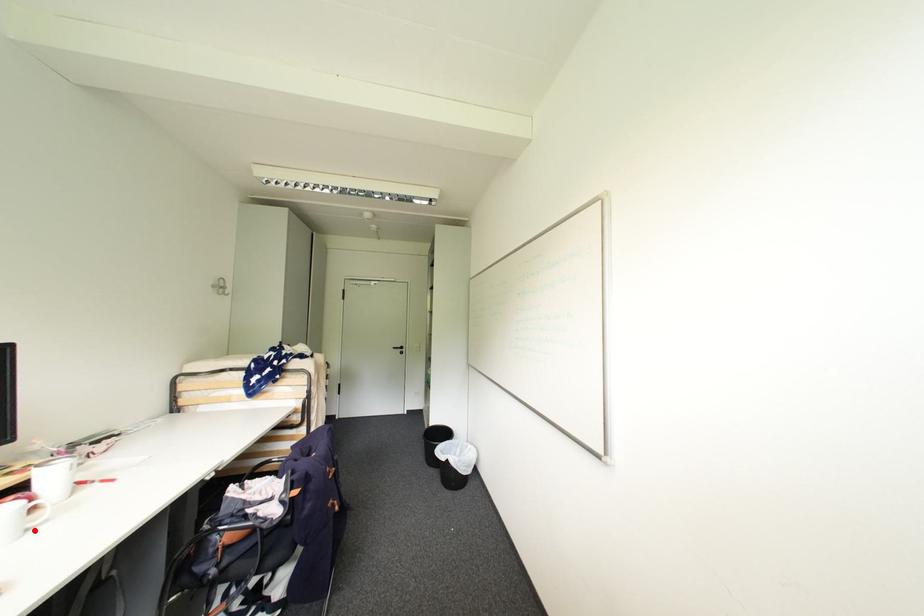
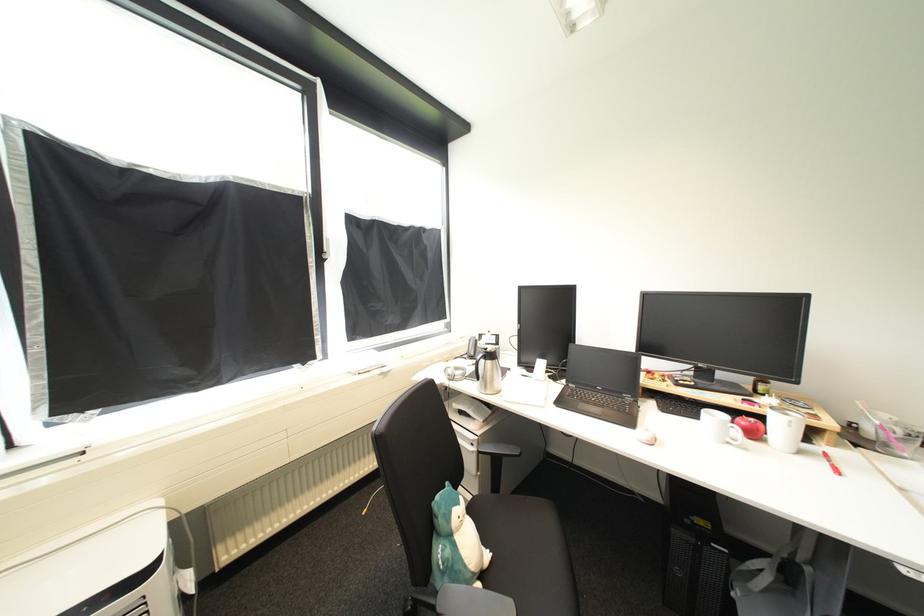
Find the pixel in the second image that matches the highlighted location in the first image.

(736, 445)